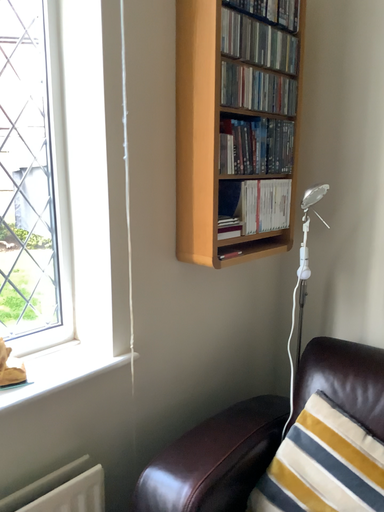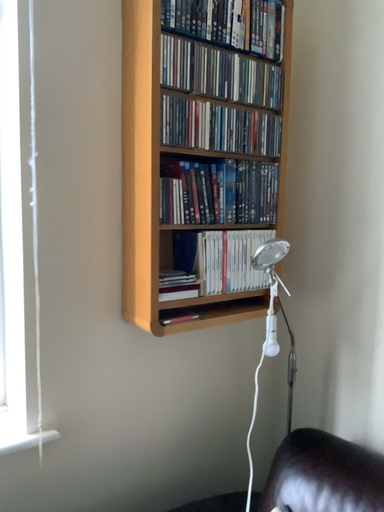
Question: How did the camera likely rotate when shooting the video?

Choices:
 (A) rotated right
 (B) rotated left

Answer: (B)